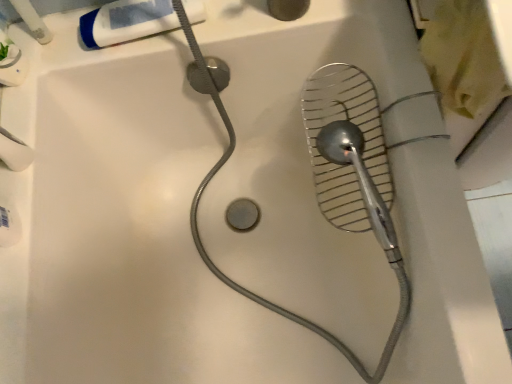
Find the location of a particular element. This screenshot has width=512, height=384. white matte tube at upper left is located at coordinates (126, 22).

This screenshot has height=384, width=512. Describe the element at coordinates (126, 22) in the screenshot. I see `white matte tube at upper left` at that location.

Image resolution: width=512 pixels, height=384 pixels. I want to click on white matte tube at upper left, so click(x=126, y=22).